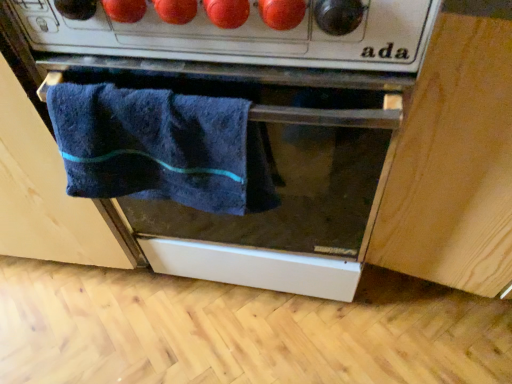
Image resolution: width=512 pixels, height=384 pixels. Identify the location of empty space that is ontop of navy blue towel at center (from a real-world perspective). (149, 92).